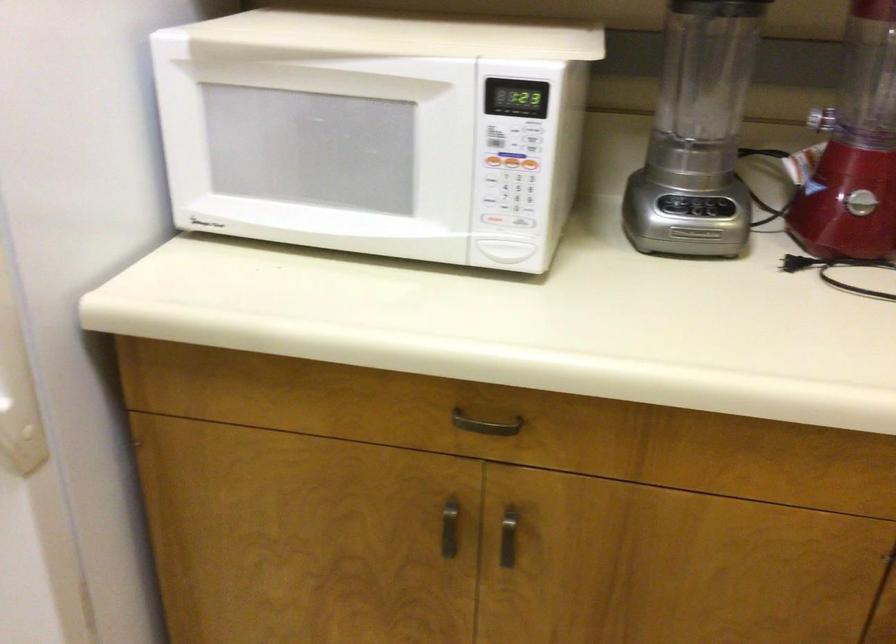
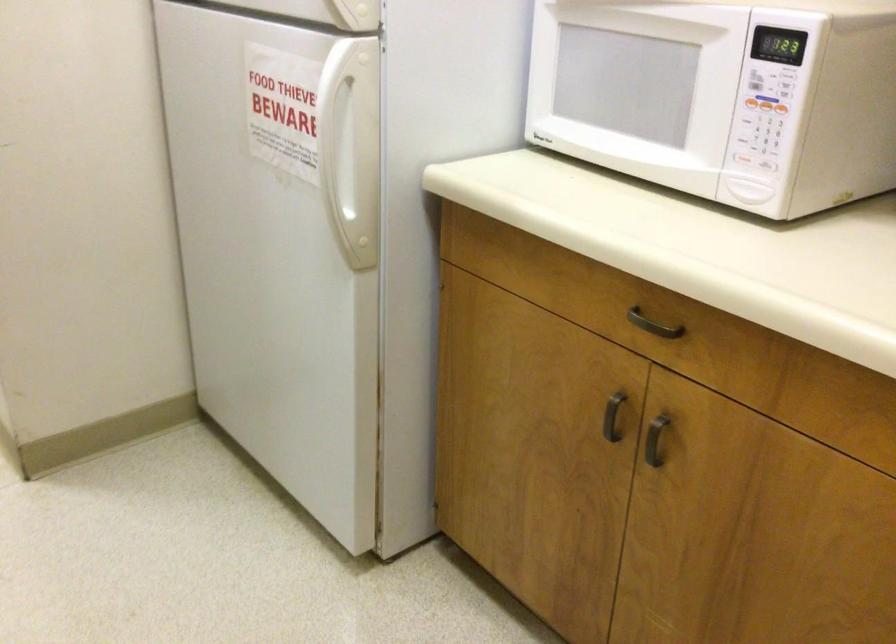
In the second image, find the point that corresponds to (x=522, y=223) in the first image.

(764, 164)